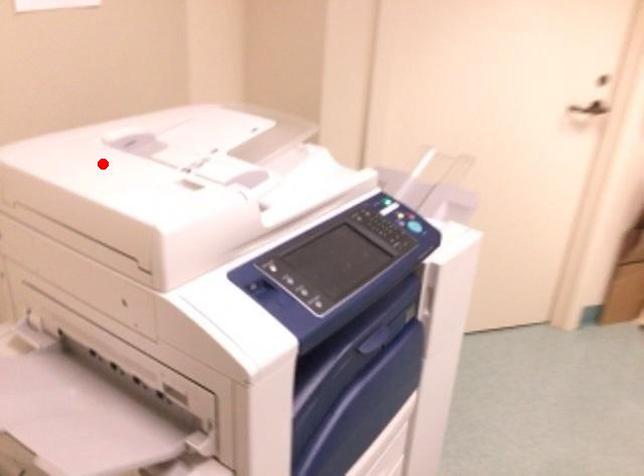
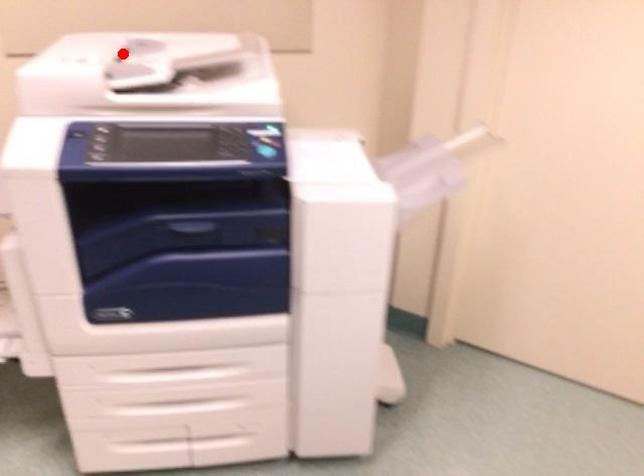
I am providing you with two images of the same scene from different viewpoints. A red point is marked on the first image and another point is marked on the second image. Is the red point in image1 aligned with the point shown in image2?

Yes